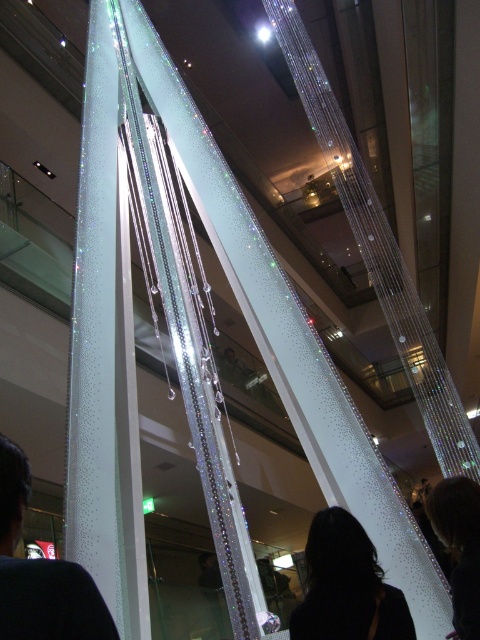
Where is `black fabric at lower left`? black fabric at lower left is located at coordinates click(x=40, y=573).

Can you confirm if black fabric at lower left is positioned to the right of dark hair at lower right?

Incorrect, black fabric at lower left is not on the right side of dark hair at lower right.

This screenshot has width=480, height=640. I want to click on black fabric at lower left, so click(x=40, y=573).

From the picture: Between black hair at center and dark hair at lower right, which one is positioned lower?

dark hair at lower right is lower down.

This screenshot has height=640, width=480. In order to click on black hair at center in this screenshot , I will do `click(347, 586)`.

This screenshot has width=480, height=640. Find the location of `black hair at center`. black hair at center is located at coordinates (347, 586).

Between black fabric at lower left and black hair at center, which one appears on the left side from the viewer's perspective?

black fabric at lower left

Is the position of black fabric at lower left less distant than that of black hair at center?

That is True.

This screenshot has width=480, height=640. Describe the element at coordinates (40, 573) in the screenshot. I see `black fabric at lower left` at that location.

Find the location of a particular element. black fabric at lower left is located at coordinates (40, 573).